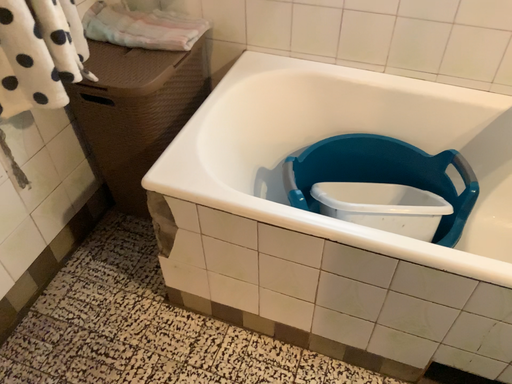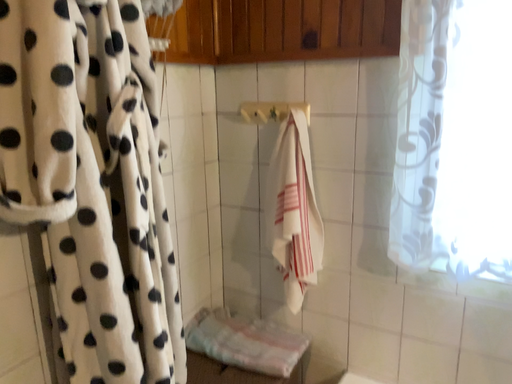
Question: Which way did the camera rotate in the video?

Choices:
 (A) rotated downward
 (B) rotated upward

Answer: (B)